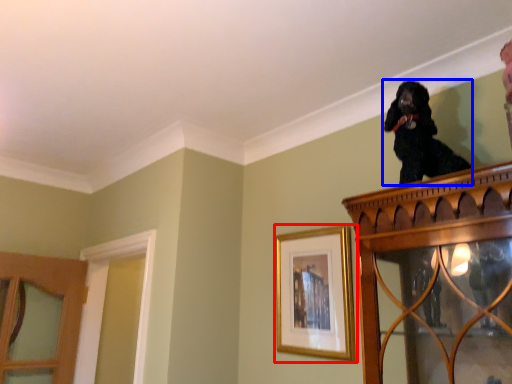
Question: Which object is further to the camera taking this photo, picture frame (highlighted by a red box) or dog (highlighted by a blue box)?

Choices:
 (A) picture frame
 (B) dog

Answer: (A)